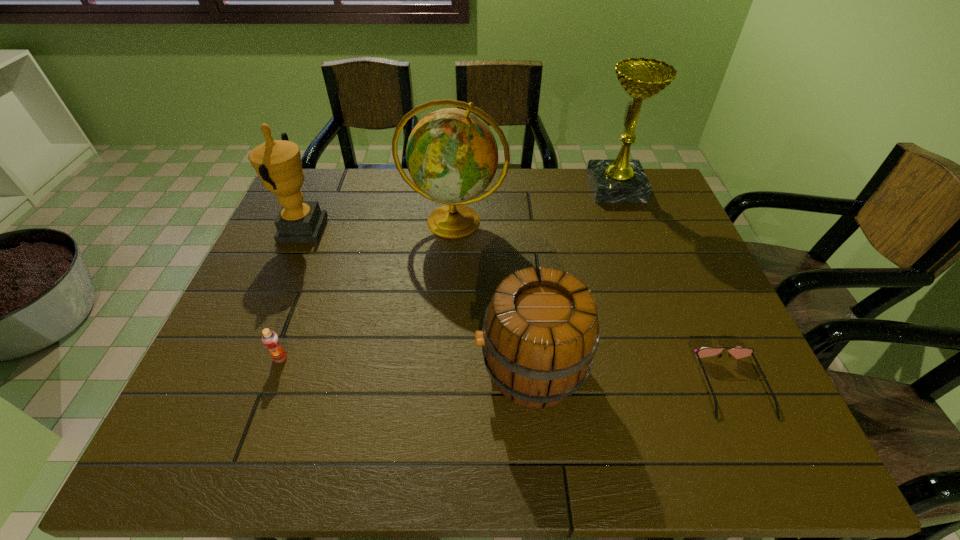
The width and height of the screenshot is (960, 540). In the image, there is a desktop. Find the location of `vacant region at the far left corner`. vacant region at the far left corner is located at coordinates (312, 199).

Image resolution: width=960 pixels, height=540 pixels. I want to click on free space between the globe and the left award, so click(x=378, y=226).

This screenshot has height=540, width=960. Identify the location of vacant space in between the shortest object and the third shortest object. (x=632, y=377).

You are a GUI agent. You are given a task and a screenshot of the screen. Output one action in this format:
    pyautogui.click(x=<x>, y=<y>)
    Task: Click on the vacant region between the globe and the right award
    The image size is (960, 540).
    Given the screenshot: What is the action you would take?
    pyautogui.click(x=535, y=205)

At what (x,y) coordinates should I click in order to perform the action: click on vacant region between the shortest object and the farther award. Please return your answer as a coordinate pair (x, y). Image resolution: width=960 pixels, height=540 pixels. Looking at the image, I should click on (674, 287).

Locate an element on the screen. The width and height of the screenshot is (960, 540). vacant point located between the globe and the right award is located at coordinates (535, 205).

The width and height of the screenshot is (960, 540). What are the coordinates of `free space between the cider and the left award` in the screenshot? It's located at (417, 299).

Locate an element on the screen. The width and height of the screenshot is (960, 540). free space between the globe and the right award is located at coordinates (535, 205).

Identify which object is the fourth closest to the globe. Please provide its 2D coordinates. Your answer should be formatted as a tuple, i.e. [(x, y)], where the tuple contains the x and y coordinates of a point satisfying the conditions above.

[(270, 339)]

At what (x,y) coordinates should I click in order to perform the action: click on object identified as the second closest to the globe. Please return your answer as a coordinate pair (x, y). This screenshot has height=540, width=960. Looking at the image, I should click on (540, 333).